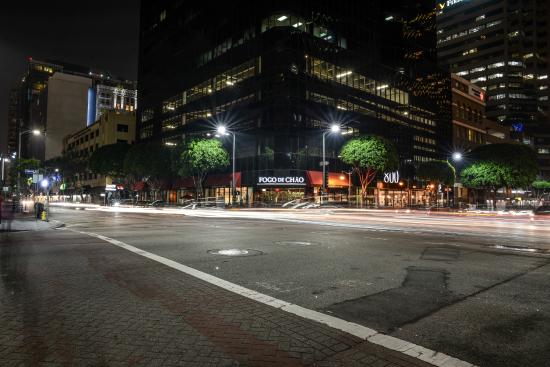
Find the location of a particular element. Image resolution: width=550 pixels, height=367 pixels. interlocking tile is located at coordinates pyautogui.click(x=240, y=323).